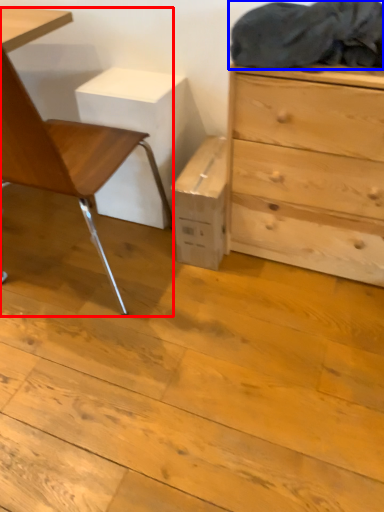
Question: Which object appears closest to the camera in this image, chair (highlighted by a red box) or laundry (highlighted by a blue box)?

Choices:
 (A) chair
 (B) laundry

Answer: (A)